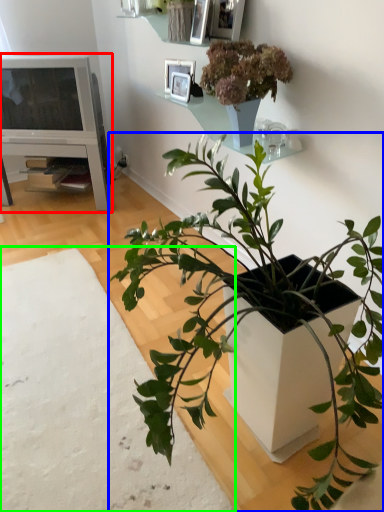
Question: Considering the real-world distances, which object is farthest from entertainment center (highlighted by a red box)? houseplant (highlighted by a blue box) or plain (highlighted by a green box)?

Choices:
 (A) houseplant
 (B) plain

Answer: (A)